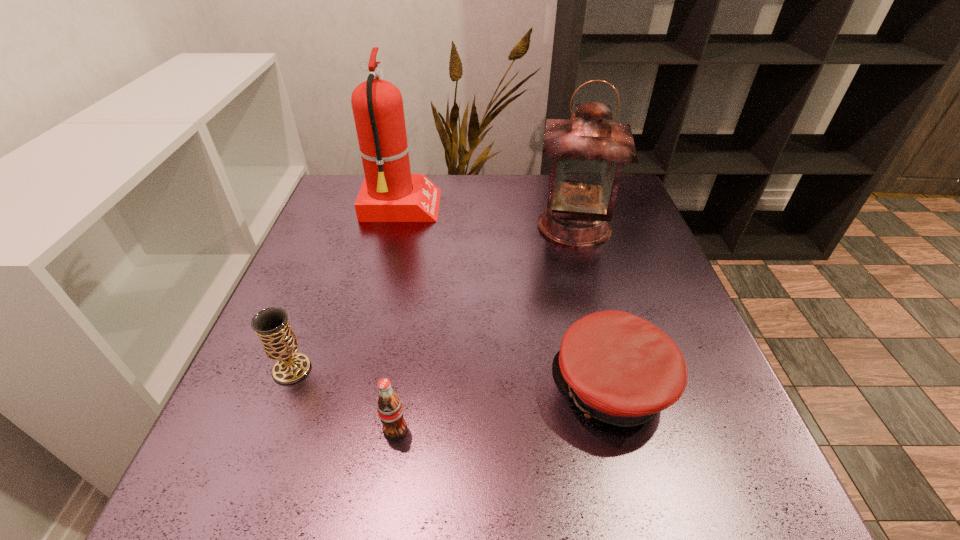
The height and width of the screenshot is (540, 960). I want to click on vacant space located on the front-facing side of the shortest object, so click(x=520, y=388).

In order to click on blank area located on the front-facing side of the shortest object in this screenshot , I will do `click(474, 388)`.

This screenshot has width=960, height=540. Find the location of `fire extinguisher situated at the far edge`. fire extinguisher situated at the far edge is located at coordinates (390, 193).

Locate an element on the screen. This screenshot has height=540, width=960. oil lamp present at the far edge is located at coordinates (588, 152).

Identify the location of fire extinguisher that is at the left edge. This screenshot has width=960, height=540. (390, 193).

At what (x,y) coordinates should I click in order to perform the action: click on chalice positioned at the left edge. Please return your answer as a coordinate pair (x, y). This screenshot has width=960, height=540. Looking at the image, I should click on (279, 342).

Where is `oil lamp present at the right edge`? Image resolution: width=960 pixels, height=540 pixels. oil lamp present at the right edge is located at coordinates (588, 152).

This screenshot has height=540, width=960. Identify the location of cap located in the right edge section of the desktop. (618, 368).

Where is `object situated at the far left corner`? object situated at the far left corner is located at coordinates click(390, 193).

Locate an element on the screen. The image size is (960, 540). object situated at the far right corner is located at coordinates (588, 152).